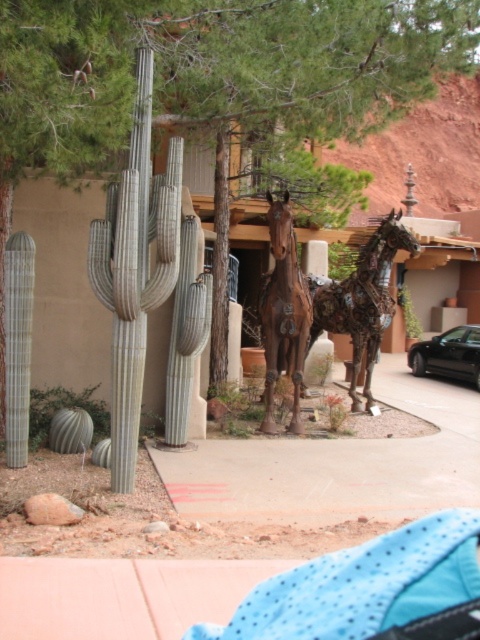
Which is behind, point (100, 298) or point (474, 358)?

The point (474, 358) is behind.

Is greenish-gray textured cactus at left bigger than black metallic car at center?

Incorrect, greenish-gray textured cactus at left is not larger than black metallic car at center.

Identify the location of greenish-gray textured cactus at left. Image resolution: width=480 pixels, height=640 pixels. [x=134, y=268].

Where is `greenish-gray textured cactus at left`? Image resolution: width=480 pixels, height=640 pixels. greenish-gray textured cactus at left is located at coordinates (134, 268).

Is point (385, 228) farther from viewer compared to point (477, 340)?

No, it is not.

Which is behind, point (394, 218) or point (432, 368)?

The point (432, 368) is behind.

Is point (370, 344) more distant than point (464, 333)?

That is False.

Locate an element on the screen. The image size is (480, 640). metallic horse at center is located at coordinates (362, 300).

Who is taller, metallic horse at center or brown matte horse at center?

brown matte horse at center

This screenshot has height=640, width=480. Describe the element at coordinates (362, 300) in the screenshot. I see `metallic horse at center` at that location.

Locate an element on the screen. The height and width of the screenshot is (640, 480). metallic horse at center is located at coordinates (362, 300).